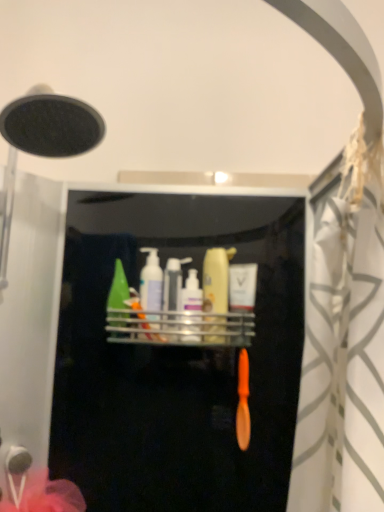
Question: Based on their sizes in the image, would you say green matte bottle at center, the first toiletry from the left, is bigger or smaller than translucent plastic bottle at center, placed as the 3th toiletry when sorted from left to right?

Choices:
 (A) big
 (B) small

Answer: (A)

Question: Is point (110, 307) closer or farther from the camera than point (193, 268)?

Choices:
 (A) closer
 (B) farther

Answer: (A)

Question: Which is nearer to the matte yellow bottle at center, which is the 4th toiletry from left to right?

Choices:
 (A) white matte pump bottle at center, positioned as the 2th toiletry in left-to-right order
 (B) green matte bottle at center, the 5th toiletry from the right
 (C) translucent plastic bottle at center, arranged as the 3th toiletry when viewed from the right
 (D) matte white lotion at center, the 5th toiletry positioned from the left
 (E) metallic silver shelf at center

Answer: (C)

Question: Which of these objects is positioned closest to the white matte pump bottle at center, positioned as the fourth toiletry in right-to-left order?

Choices:
 (A) matte white lotion at center, the 5th toiletry positioned from the left
 (B) metallic silver shelf at center
 (C) matte yellow bottle at center, which is the 4th toiletry from left to right
 (D) translucent plastic bottle at center, arranged as the 3th toiletry when viewed from the right
 (E) green matte bottle at center, the 5th toiletry from the right

Answer: (E)